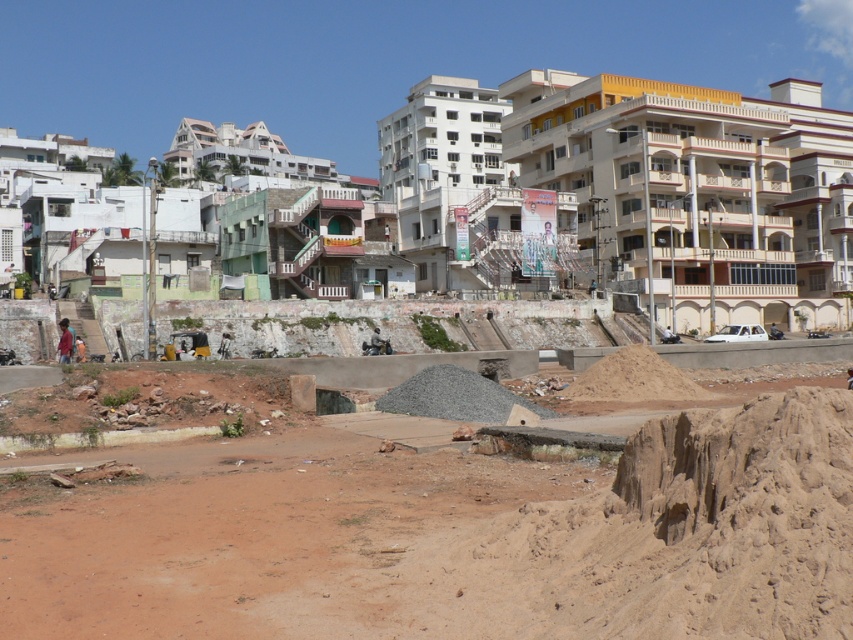
Question: Can you confirm if brown sandy dirt field at lower center is thinner than gray gravel pile at center?

Choices:
 (A) yes
 (B) no

Answer: (B)

Question: Which of the following is the farthest from the observer?

Choices:
 (A) brown sandy mound at center
 (B) brown sandy dirt field at lower center

Answer: (A)

Question: Can you confirm if gray gravel pile at center is smaller than brown sandy mound at center?

Choices:
 (A) yes
 (B) no

Answer: (A)

Question: Where is gray gravel pile at center located in relation to brown sandy mound at center in the image?

Choices:
 (A) right
 (B) left

Answer: (B)

Question: Which point is closer to the camera?

Choices:
 (A) (61, 547)
 (B) (421, 381)
 (C) (589, 376)

Answer: (A)

Question: Which of the following is the closest to the observer?

Choices:
 (A) (436, 401)
 (B) (666, 392)

Answer: (A)